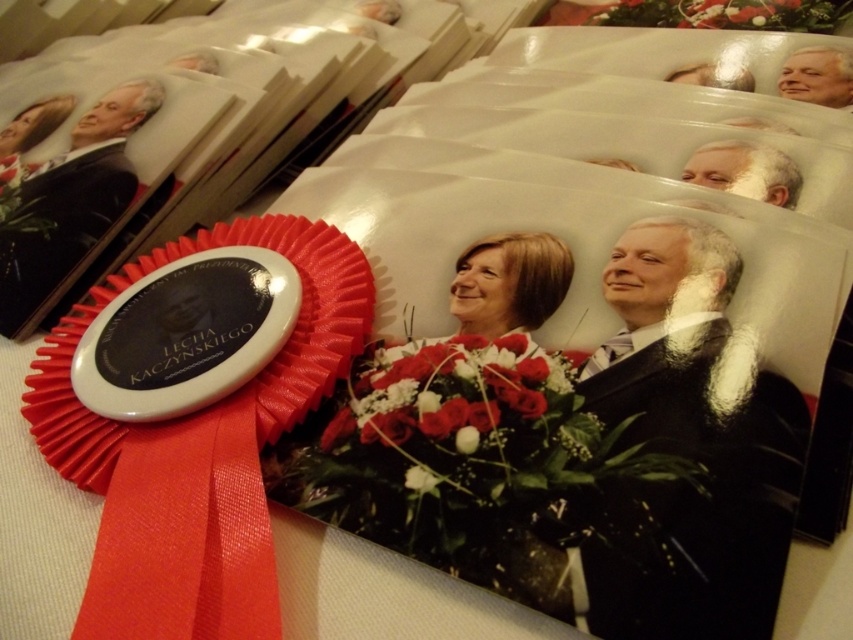
Question: Is matte black portrait at upper left below red silk flower at center?

Choices:
 (A) no
 (B) yes

Answer: (A)

Question: Among these objects, which one is nearest to the camera?

Choices:
 (A) matte black portrait at upper left
 (B) white textured suit at center
 (C) smooth white face at upper right
 (D) red silk flower at center

Answer: (B)

Question: Observing the image, what is the correct spatial positioning of matte black portrait at upper left in reference to smooth white face at upper right?

Choices:
 (A) below
 (B) above

Answer: (A)

Question: Is red satin ribbon at center above white textured suit at center?

Choices:
 (A) yes
 (B) no

Answer: (B)

Question: Which of the following is the farthest from the observer?

Choices:
 (A) (96, 104)
 (B) (525, 392)
 (C) (747, 440)
 (D) (831, 72)

Answer: (A)

Question: Which of the following is the farthest from the observer?

Choices:
 (A) (83, 193)
 (B) (625, 371)

Answer: (A)